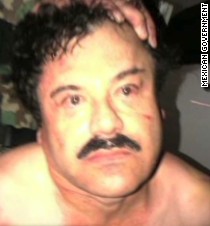
Find the location of a particular element. wall is located at coordinates (195, 113).